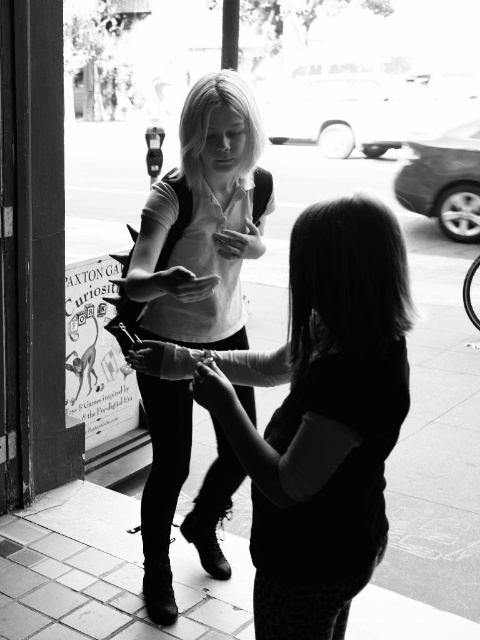
Based on the photo, does matte black shirt at center have a greater height compared to matte white shirt at center?

No, matte black shirt at center is not taller than matte white shirt at center.

Identify the location of matte black shirt at center. (316, 417).

The image size is (480, 640). Find the location of `matte black shirt at center`. matte black shirt at center is located at coordinates (316, 417).